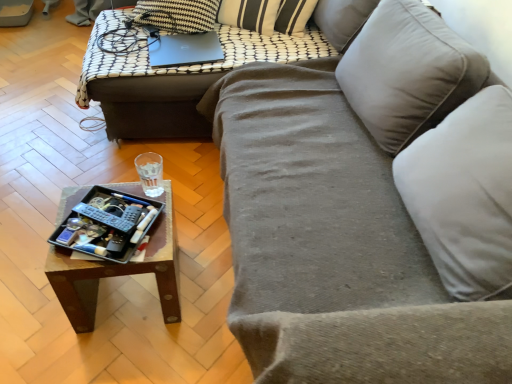
This screenshot has height=384, width=512. In order to click on vacant space to the right of wooden tray at center in this screenshot , I will do point(204,300).